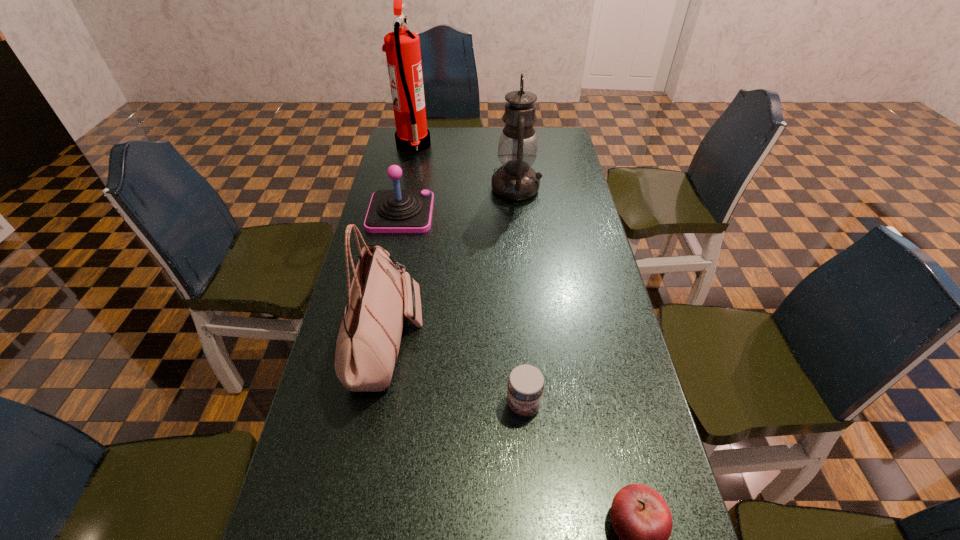
Find the location of a particular element. The width and height of the screenshot is (960, 540). free point between the oil lamp and the jam is located at coordinates (519, 297).

Locate an element on the screen. vacant area that lies between the fire extinguisher and the oil lamp is located at coordinates (465, 167).

Locate an element on the screen. This screenshot has height=540, width=960. empty space that is in between the jam and the farthest object is located at coordinates (468, 275).

The width and height of the screenshot is (960, 540). In order to click on free spot between the tallest object and the oil lamp in this screenshot , I will do `click(465, 167)`.

Point out which object is positioned as the fourth nearest to the fire extinguisher. Please provide its 2D coordinates. Your answer should be formatted as a tuple, i.e. [(x, y)], where the tuple contains the x and y coordinates of a point satisfying the conditions above.

[(526, 383)]

Locate an element on the screen. The image size is (960, 540). object that is the fourth closest one to the handbag is located at coordinates click(641, 518).

The width and height of the screenshot is (960, 540). Find the location of `free location that satisfies the following two spatial constraints: 1. with the nozzle aimed from the tallest object; 2. on the left side of the oil lamp`. free location that satisfies the following two spatial constraints: 1. with the nozzle aimed from the tallest object; 2. on the left side of the oil lamp is located at coordinates coord(404,188).

You are a GUI agent. You are given a task and a screenshot of the screen. Output one action in this format:
    pyautogui.click(x=<x>, y=<y>)
    Task: Click on the vacant space that satisfies the following two spatial constraints: 1. with the nozzle aimed from the fire extinguisher; 2. on the left side of the oil lamp
    
    Given the screenshot: What is the action you would take?
    pyautogui.click(x=404, y=188)